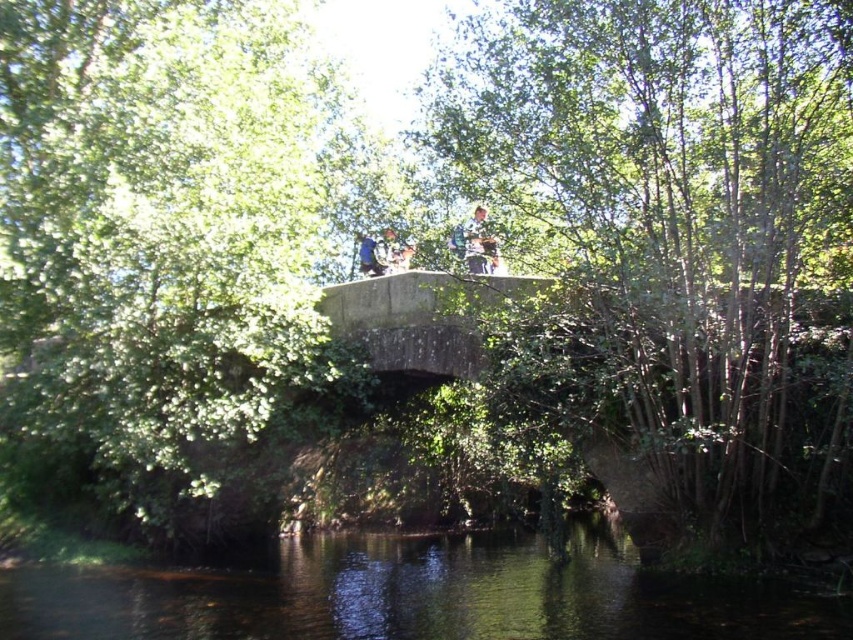
You are observing two people in the image, a camouflage fabric person at center and a blue fabric person at center. Which person is closer to you?

The camouflage fabric person at center is closer to you because they are positioned over the blue fabric person at center, indicating that they are in front.

In the scene shown: You are standing on the stone bridge and see the dark green water at center and the camouflage fabric person at center. Which object is positioned to the left? Please answer based on the scene description.

The dark green water at center is to the left of camouflage fabric person at center, so the dark green water at center is positioned to the left.